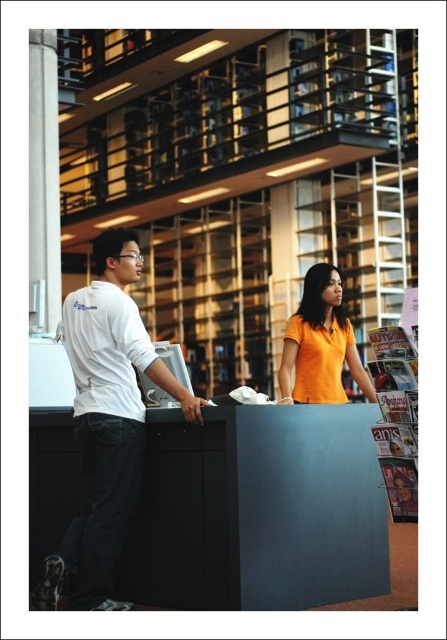
You are a librarian who needs to deliver a book to a patron standing at the orange matte shirt at center. You are currently at the white matte shirt at left. Is the distance between you and the patron sufficient to walk directly to them without needing to move any obstacles?

The distance between the white matte shirt at left and the orange matte shirt at center is 6.04 feet, which is enough space for a librarian to walk directly to the patron without needing to move any obstacles.

You are a visitor at the library and want to ask the staff member wearing the orange matte shirt at center for directions. You are currently standing at the entrance near the matte black desk at center. To reach the staff member, should you move to your left or right side?

The matte black desk at center is to the left of orange matte shirt at center. Since you are at the desk, to reach the staff member, you should move to your right side.